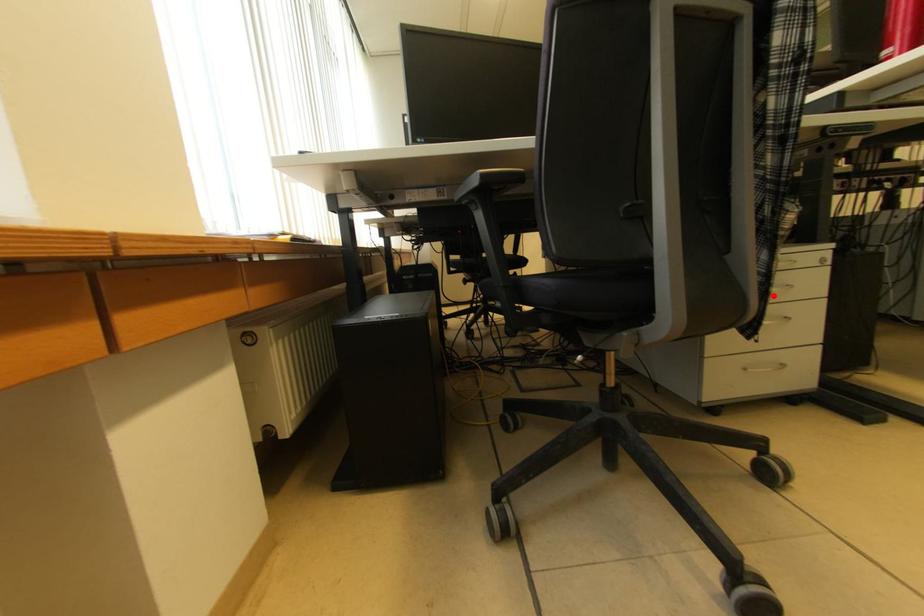
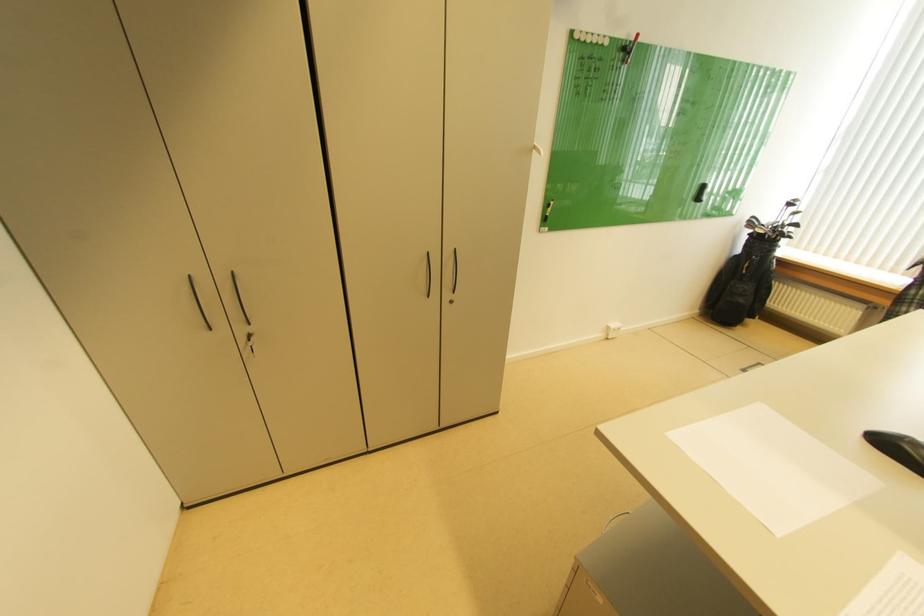
Question: I am providing you with two images of the same scene from different viewpoints. A red point is marked on the first image. Is the red point's position out of view in image 2?

Choices:
 (A) Yes
 (B) No

Answer: (A)